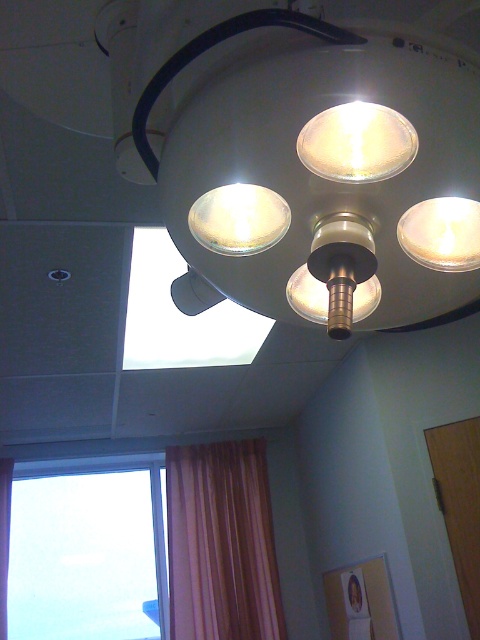
Question: Can you confirm if transparent glass window at lower left is positioned below matte white light at center?

Choices:
 (A) no
 (B) yes

Answer: (B)

Question: Is matte white light at center closer to the viewer compared to pink fabric curtain at left?

Choices:
 (A) yes
 (B) no

Answer: (A)

Question: Which object appears farthest from the camera in this image?

Choices:
 (A) pink fabric curtain at left
 (B) matte gold lamp at upper center
 (C) matte white lamp at center
 (D) transparent glass window at lower left

Answer: (D)

Question: Which point is farther to the camera?

Choices:
 (A) matte white light at center
 (B) matte white lamp at center
 (C) matte gold lamp at upper center

Answer: (C)

Question: Which of the following is the closest to the observer?

Choices:
 (A) orange fabric curtain at lower left
 (B) matte white lamp at upper center
 (C) matte white lamp at center
 (D) matte gold lamp at upper center

Answer: (B)

Question: From the image, what is the correct spatial relationship of matte white lamp at center in relation to matte gold lamp at upper center?

Choices:
 (A) below
 (B) above

Answer: (B)